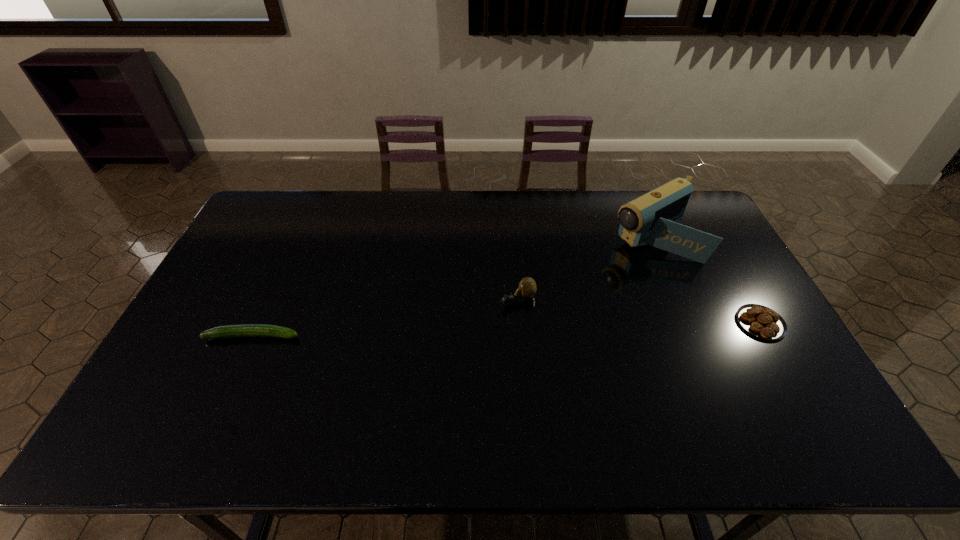
This screenshot has width=960, height=540. Find the location of `free area in between the leftmost object and the escargot`. free area in between the leftmost object and the escargot is located at coordinates (385, 318).

Identify the location of free space between the farthest object and the zucchini. (452, 287).

The height and width of the screenshot is (540, 960). Identify the location of vacant space that's between the escargot and the zucchini. (385, 318).

What are the coordinates of `vacant point located between the second object from left to right and the pastry` in the screenshot? It's located at (638, 312).

Find the location of a particular element. The image size is (960, 540). object that ranks as the second closest to the leftmost object is located at coordinates click(x=651, y=219).

Locate an element on the screen. This screenshot has width=960, height=540. the closest object relative to the third shortest object is located at coordinates (651, 219).

Where is `free space that satisfies the following two spatial constraints: 1. on the front side of the pastry; 2. on the right side of the third shortest object`? Image resolution: width=960 pixels, height=540 pixels. free space that satisfies the following two spatial constraints: 1. on the front side of the pastry; 2. on the right side of the third shortest object is located at coordinates [x=518, y=323].